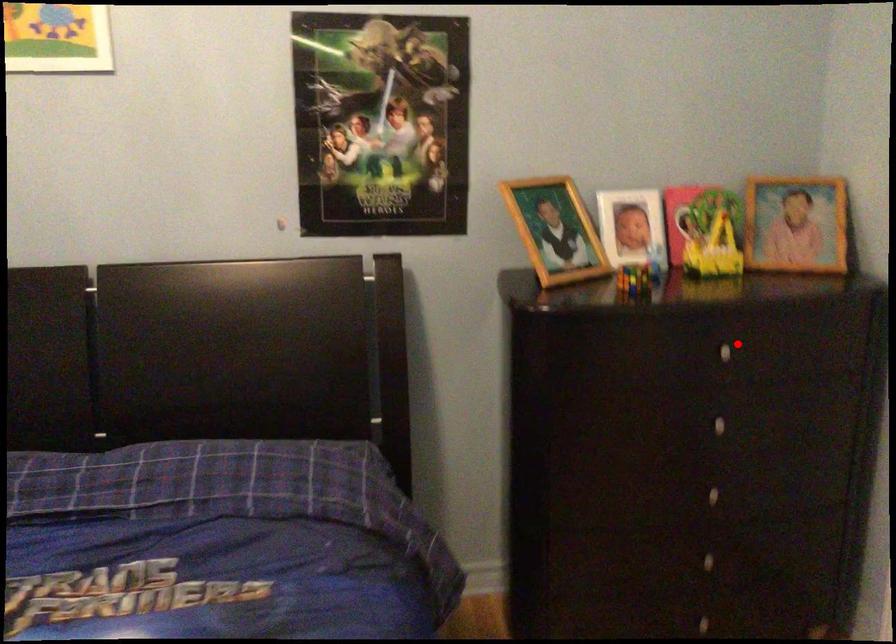
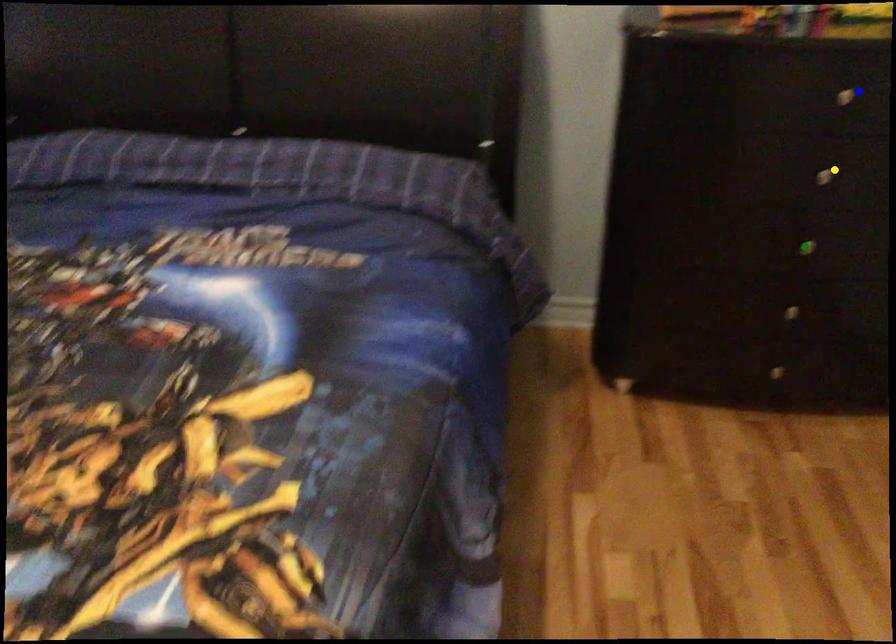
Question: I am providing you with two images of the same scene from different viewpoints. A red point is marked on the first image. You are given multiple points on the second image. Which spot in image 2 lines up with the point in image 1?

Choices:
 (A) blue point
 (B) yellow point
 (C) green point

Answer: (A)